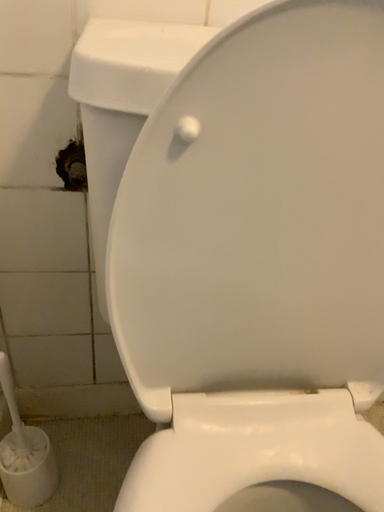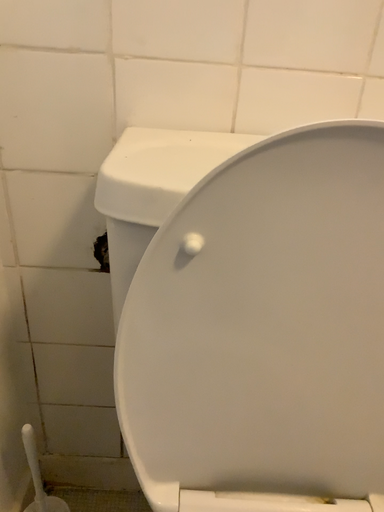
Question: How did the camera likely rotate when shooting the video?

Choices:
 (A) rotated downward
 (B) rotated upward

Answer: (B)